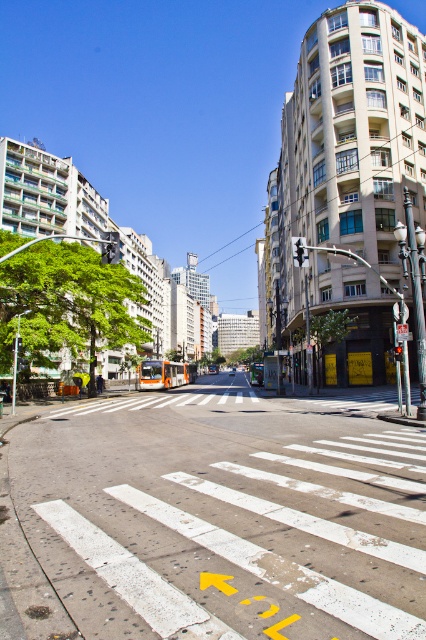
You are standing at the corner of the crosswalk in the urban street scene. You notice a white painted crosswalk at center located at point (x=212, y=518). If you were to walk straight ahead from your current position, would you be walking towards the buildings with balconies and greenery on the left or the older classic style buildings on the right?

The white painted crosswalk at center is located at point (x=212, y=518). Since the crosswalk is at the center of the street, walking straight ahead from the corner would lead you towards the middle of the street. However, the buildings with balconies and greenery are on the left side of the street, while the older classic style buildings are on the right. Therefore, the crosswalk directs you toward the middle, but the question asks which direction the buildings are located. To reach the buildings with balcon

You are standing at the crosswalk corner and want to take a photo that includes both point [293,252] and point [402,348]. Which point will appear larger in the photo?

Point [293,252] is closer to the camera than point [402,348], so it will appear larger in the photo.

You are a pedestrian standing at the crosswalk and want to know which traffic light is closer to you. Which one is closer between the metallic traffic light at center and the red glass traffic light at center?

The metallic traffic light at center is closer to the viewer than the red glass traffic light at center.